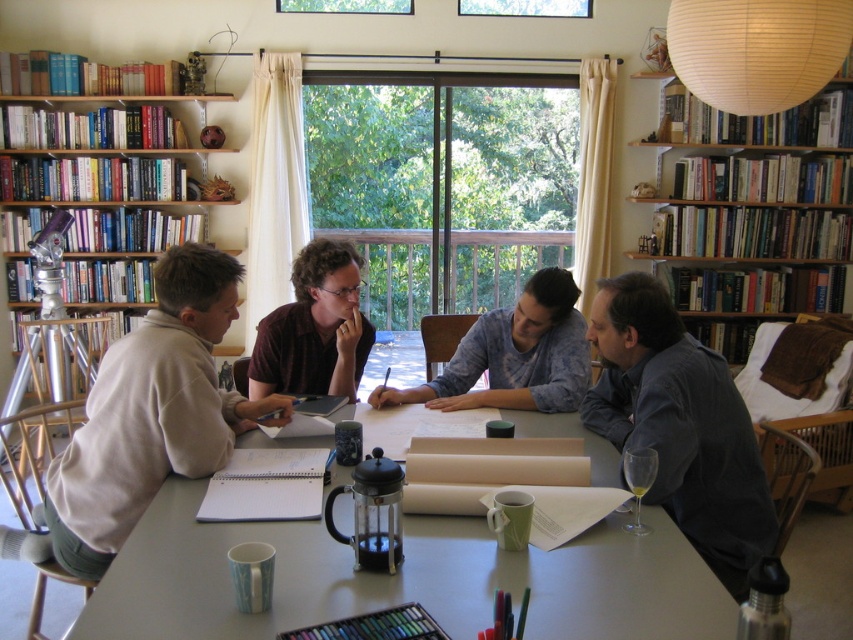
You are taking a photo of the scene and want to focus on both point (149, 618) and point (740, 362). Since you can only focus on one point at a time, which point should you choose to ensure the other is also in acceptable focus range? The acceptable focus range extends 0.3 units from the focused point along the z axis.

You should focus on point (740, 362) because it is farther from the camera. Since the acceptable focus range extends 0.3 units from the focused point, focusing on the farther point ensures the closer point (149, 618) falls within its focus range.

You are standing in the room and want to place a new poster on the wall between the dark blue shirt at lower right and the wooden bookshelf at upper left. Based on their positions, where should you position the poster to ensure it is centered between them?

The dark blue shirt at lower right is to the right of the wooden bookshelf at upper left, so to center the poster between them, place it slightly to the right of the midpoint between the two objects.

You are a person who is 1.7 meters tall. You want to place a 1.8 meter tall potted plant on the white matte table at center so that it can be seen from the wooden bookshelf at upper right. Will the plant be visible from there?

The white matte table at center has a lesser height compared to wooden bookshelf at upper right. Since the plant is 1.8 meters tall and the table is shorter than the bookshelf, the top of the plant may be visible from the bookshelf if the bookshelf is not too far away. However, the exact visibility depends on the distance between them, which isn